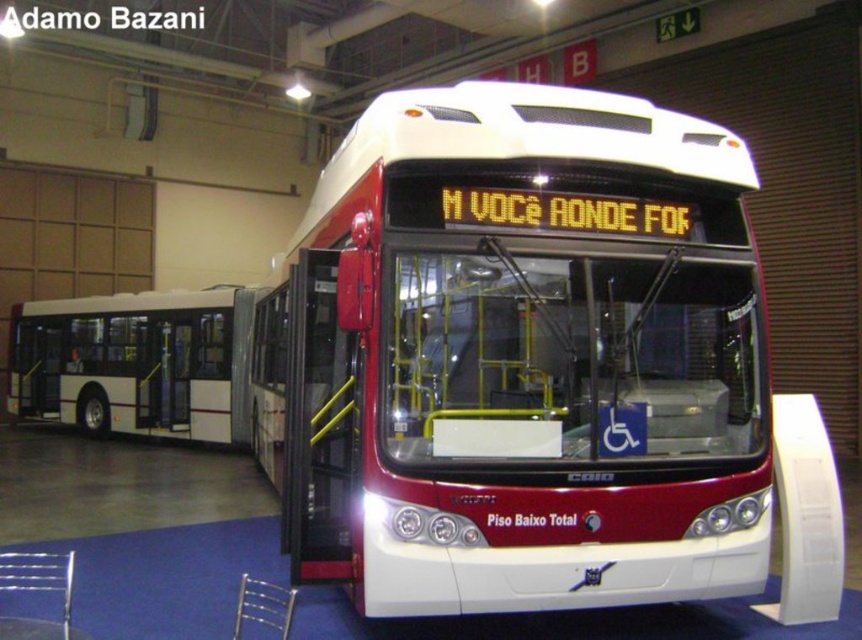
Question: Which of the following is the closest to the observer?

Choices:
 (A) matte white bus at center
 (B) white matte bus at left

Answer: (A)

Question: Can you confirm if matte white bus at center is positioned above white matte bus at left?

Choices:
 (A) yes
 (B) no

Answer: (B)

Question: Where is matte white bus at center located in relation to white matte bus at left in the image?

Choices:
 (A) below
 (B) above

Answer: (A)

Question: Does matte white bus at center have a larger size compared to white matte bus at left?

Choices:
 (A) no
 (B) yes

Answer: (A)

Question: Which of the following is the farthest from the observer?

Choices:
 (A) (395, 554)
 (B) (27, 406)

Answer: (B)